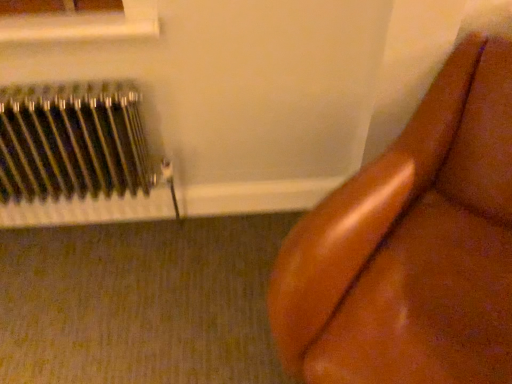
Question: Can you confirm if white plastic window frame at upper left is bigger than metallic silver radiator at left?

Choices:
 (A) yes
 (B) no

Answer: (B)

Question: Considering the relative sizes of white plastic window frame at upper left and metallic silver radiator at left in the image provided, is white plastic window frame at upper left taller than metallic silver radiator at left?

Choices:
 (A) no
 (B) yes

Answer: (A)

Question: From a real-world perspective, is white plastic window frame at upper left positioned under metallic silver radiator at left based on gravity?

Choices:
 (A) yes
 (B) no

Answer: (B)

Question: Is white plastic window frame at upper left smaller than metallic silver radiator at left?

Choices:
 (A) no
 (B) yes

Answer: (B)

Question: Is white plastic window frame at upper left at the right side of metallic silver radiator at left?

Choices:
 (A) no
 (B) yes

Answer: (B)

Question: Considering the relative positions of brown leather couch at right and metallic silver radiator at left in the image provided, is brown leather couch at right to the left or to the right of metallic silver radiator at left?

Choices:
 (A) left
 (B) right

Answer: (B)

Question: From a real-world perspective, relative to metallic silver radiator at left, is brown leather couch at right vertically above or below?

Choices:
 (A) below
 (B) above

Answer: (A)

Question: From their relative heights in the image, would you say brown leather couch at right is taller or shorter than metallic silver radiator at left?

Choices:
 (A) short
 (B) tall

Answer: (B)

Question: Considering the positions of point (377, 349) and point (155, 170), is point (377, 349) closer or farther from the camera than point (155, 170)?

Choices:
 (A) closer
 (B) farther

Answer: (A)

Question: Visually, is metallic silver radiator at left positioned to the left or to the right of brown leather couch at right?

Choices:
 (A) left
 (B) right

Answer: (A)

Question: Does point (45, 203) appear closer or farther from the camera than point (440, 200)?

Choices:
 (A) farther
 (B) closer

Answer: (A)

Question: From the image's perspective, is metallic silver radiator at left above or below brown leather couch at right?

Choices:
 (A) below
 (B) above

Answer: (B)

Question: From their relative heights in the image, would you say metallic silver radiator at left is taller or shorter than brown leather couch at right?

Choices:
 (A) short
 (B) tall

Answer: (A)

Question: Does point (108, 24) appear closer or farther from the camera than point (309, 367)?

Choices:
 (A) farther
 (B) closer

Answer: (A)

Question: From their relative heights in the image, would you say white plastic window frame at upper left is taller or shorter than brown leather couch at right?

Choices:
 (A) tall
 (B) short

Answer: (B)